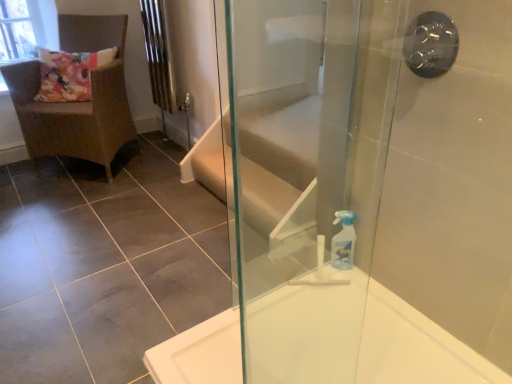
Question: Should I look upward or downward to see transparent glass window screen at upper left?

Choices:
 (A) up
 (B) down

Answer: (A)

Question: Is black metallic shower handle at upper right next to transparent plastic spray bottle at right?

Choices:
 (A) yes
 (B) no

Answer: (B)

Question: From a real-world perspective, is black metallic shower handle at upper right positioned under transparent plastic spray bottle at right based on gravity?

Choices:
 (A) yes
 (B) no

Answer: (B)

Question: Is transparent plastic spray bottle at right located within black metallic shower handle at upper right?

Choices:
 (A) yes
 (B) no

Answer: (B)

Question: Can you confirm if black metallic shower handle at upper right is taller than transparent plastic spray bottle at right?

Choices:
 (A) no
 (B) yes

Answer: (A)

Question: Is black metallic shower handle at upper right positioned beyond the bounds of transparent plastic spray bottle at right?

Choices:
 (A) yes
 (B) no

Answer: (A)

Question: Considering the relative positions of black metallic shower handle at upper right and transparent plastic spray bottle at right in the image provided, is black metallic shower handle at upper right to the left of transparent plastic spray bottle at right from the viewer's perspective?

Choices:
 (A) yes
 (B) no

Answer: (B)

Question: Can you confirm if transparent glass screen door at right is wider than brown woven chair at upper left?

Choices:
 (A) no
 (B) yes

Answer: (A)

Question: Is transparent glass screen door at right next to brown woven chair at upper left?

Choices:
 (A) no
 (B) yes

Answer: (A)

Question: Is transparent glass screen door at right turned away from brown woven chair at upper left?

Choices:
 (A) yes
 (B) no

Answer: (A)

Question: From a real-world perspective, is transparent glass screen door at right located higher than brown woven chair at upper left?

Choices:
 (A) no
 (B) yes

Answer: (B)

Question: Is transparent glass screen door at right surrounding brown woven chair at upper left?

Choices:
 (A) yes
 (B) no

Answer: (B)

Question: Considering the relative sizes of transparent glass screen door at right and brown woven chair at upper left in the image provided, is transparent glass screen door at right taller than brown woven chair at upper left?

Choices:
 (A) yes
 (B) no

Answer: (A)

Question: From the image's perspective, is brown woven chair at upper left over black metallic shower handle at upper right?

Choices:
 (A) no
 (B) yes

Answer: (B)